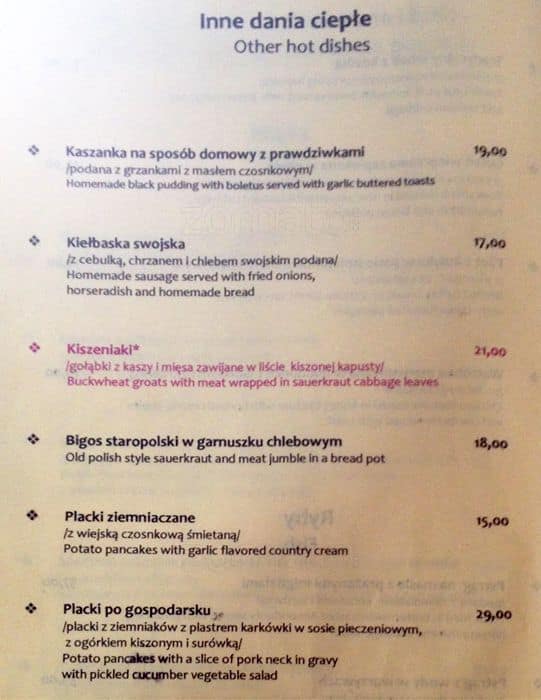
Image resolution: width=541 pixels, height=700 pixels. What are the coordinates of `5 dolls` in the screenshot? It's located at (490, 511).